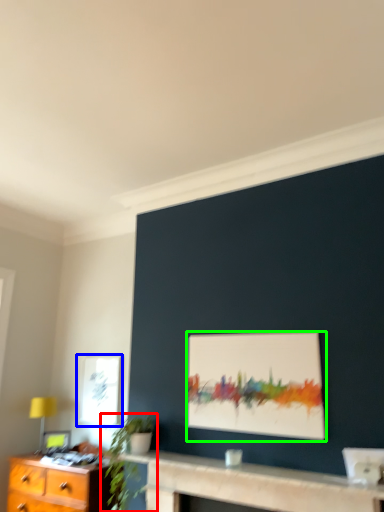
Question: Which is nearer to the houseplant (highlighted by a red box)? window (highlighted by a blue box) or picture frame (highlighted by a green box).

Choices:
 (A) window
 (B) picture frame

Answer: (A)